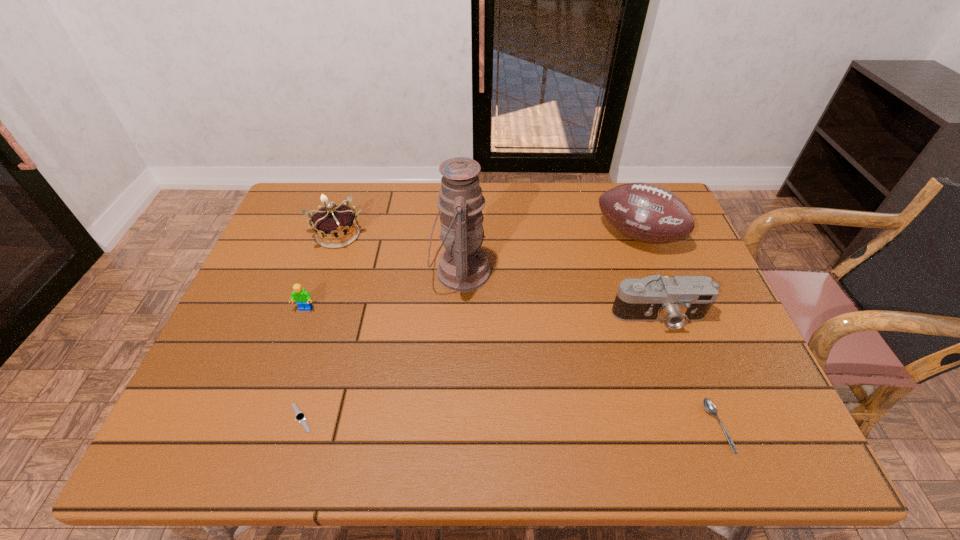
Locate an element on the screen. free spot at the near left corner of the desktop is located at coordinates (189, 434).

Locate an element on the screen. The height and width of the screenshot is (540, 960). vacant space in between the soupspoon and the Lego is located at coordinates (512, 368).

Identify the location of empty location between the Lego and the watch. (303, 363).

Locate an element on the screen. This screenshot has height=540, width=960. free spot between the football (American) and the fourth object from left to right is located at coordinates (549, 254).

Image resolution: width=960 pixels, height=540 pixels. I want to click on free area in between the tallest object and the soupspoon, so click(x=589, y=349).

You are a GUI agent. You are given a task and a screenshot of the screen. Output one action in this format:
    pyautogui.click(x=<x>, y=<y>)
    Task: Click on the vacant area that lies between the watch and the soupspoon
    
    Given the screenshot: What is the action you would take?
    pyautogui.click(x=510, y=422)

You are a GUI agent. You are given a task and a screenshot of the screen. Output one action in this format:
    pyautogui.click(x=<x>, y=<y>)
    Task: Click on the free area in between the camera and the fifth tallest object
    The image size is (960, 540).
    Given the screenshot: What is the action you would take?
    pyautogui.click(x=482, y=313)

The width and height of the screenshot is (960, 540). In order to click on free spot between the camera and the crown in this screenshot , I will do `click(498, 276)`.

Find the location of a particular element. unoccupied area between the second shortest object and the shortest object is located at coordinates click(510, 422).

Locate which object is the third closest to the tallest object. Please provide its 2D coordinates. Your answer should be formatted as a tuple, i.e. [(x, y)], where the tuple contains the x and y coordinates of a point satisfying the conditions above.

[(675, 301)]